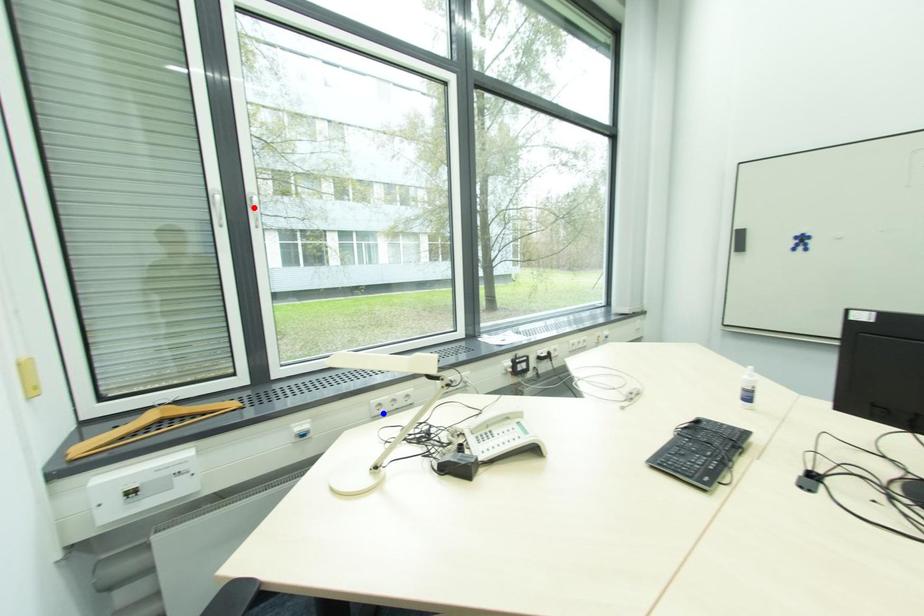
Question: Which of the two points in the image is closer to the camera?

Choices:
 (A) Blue point is closer.
 (B) Red point is closer.

Answer: (A)